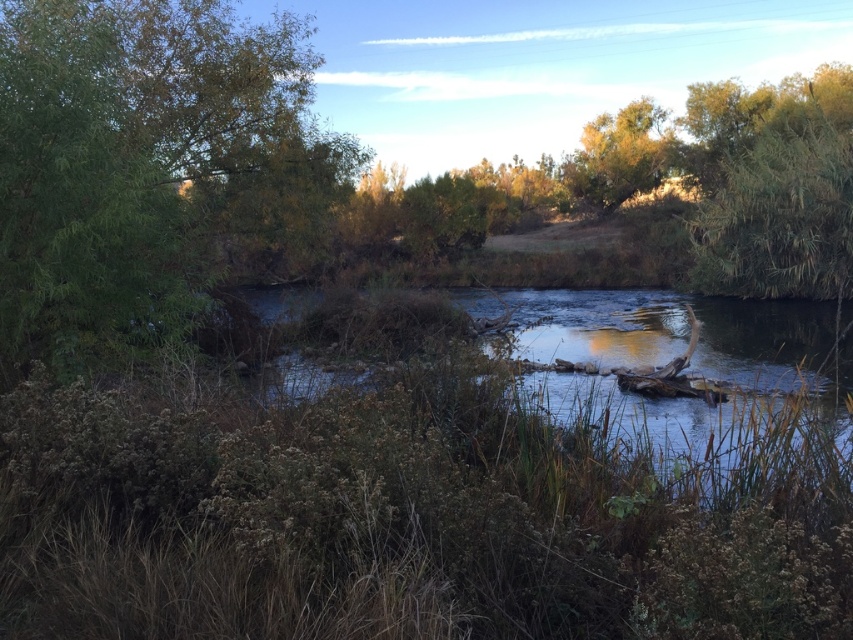
You are a bird looking for a nesting spot. You see two trees in the scene, the green leafy tree at left and the green leafy tree at upper right. Which tree would provide a larger space for your nest?

The green leafy tree at upper right is larger in size compared to the green leafy tree at left, so it would provide a larger space for your nest.

You are standing at the edge of the river and want to locate the smooth brown water at center. Based on the coordinates provided, where exactly would you find it?

The smooth brown water at center is located at the coordinates point (x=688, y=371).

You are standing on the riverbank and see the green leafy tree at left and the smooth brown water at center. Which object is positioned more to the left?

The green leafy tree at left is positioned more to the left than the smooth brown water at center.